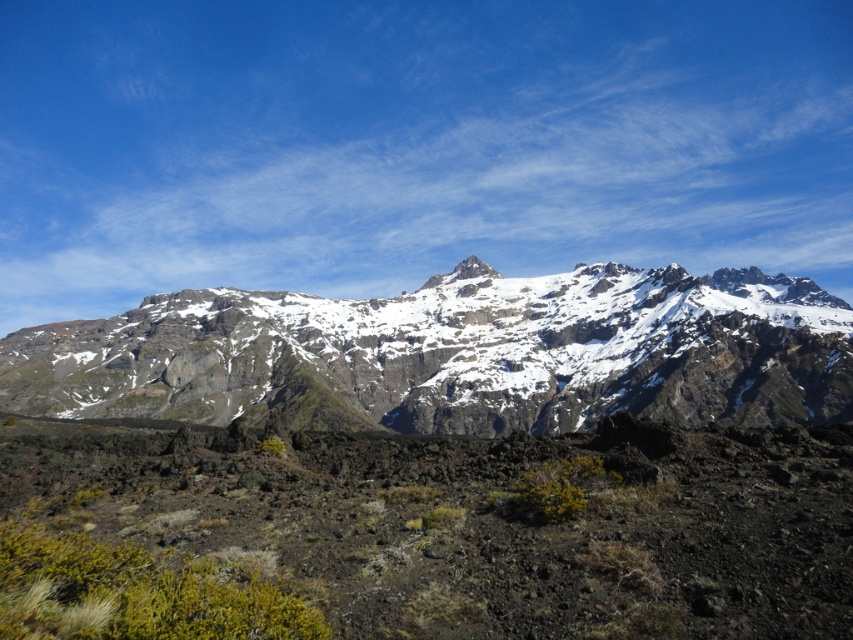
Who is taller, snowy rocky mountain range at center or white rocky peak at center?

With more height is snowy rocky mountain range at center.

Who is lower down, snowy rocky mountain range at center or white rocky peak at center?

snowy rocky mountain range at center is below.

Measure the distance between point (637, 349) and camera.

Point (637, 349) and camera are 147.51 meters apart from each other.

Find the location of a particular element. The image size is (853, 640). snowy rocky mountain range at center is located at coordinates [461, 353].